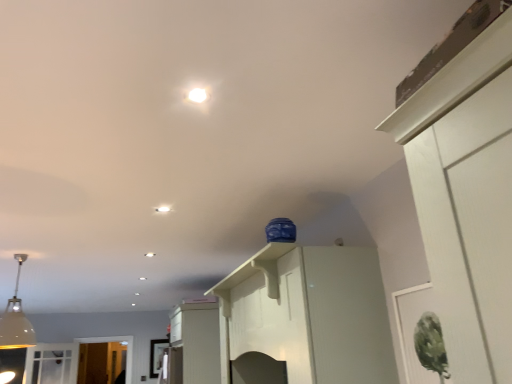
Measure the distance between white matte pendant light at left and camera.

A distance of 9.33 feet exists between white matte pendant light at left and camera.

Where is `white glossy cabinet at center, which is the 2th cabinetry in front-to-back order`? Image resolution: width=512 pixels, height=384 pixels. white glossy cabinet at center, which is the 2th cabinetry in front-to-back order is located at coordinates (198, 341).

Where is `white glossy light fixture at upper center`? white glossy light fixture at upper center is located at coordinates (197, 95).

At what (x,y) coordinates should I click in order to perform the action: click on white glossy light fixture at center. Please return your answer as a coordinate pair (x, y). Looking at the image, I should click on (163, 209).

Locate an element on the screen. Image resolution: width=512 pixels, height=384 pixels. white matte pendant light at left is located at coordinates (16, 319).

From the image's perspective, would you say white glossy light fixture at center is positioned over white matte pendant light at left?

Indeed, from the image's perspective, white glossy light fixture at center is shown above white matte pendant light at left.

How many degrees apart are the facing directions of white glossy light fixture at center and white matte pendant light at left?

87.2 degrees.

Is white glossy light fixture at center next to white matte pendant light at left and touching it?

There is a gap between white glossy light fixture at center and white matte pendant light at left.

Locate an element on the screen. Image resolution: width=512 pixels, height=384 pixels. light on the right of white matte pendant light at left is located at coordinates (163, 209).

From their relative heights in the image, would you say white matte pendant light at left is taller or shorter than white glossy light fixture at upper center?

white matte pendant light at left is taller than white glossy light fixture at upper center.

Does white matte pendant light at left have a greater width compared to white glossy light fixture at upper center?

Yes, white matte pendant light at left is wider than white glossy light fixture at upper center.

Which is more to the right, white matte pendant light at left or white glossy light fixture at upper center?

Positioned to the right is white glossy light fixture at upper center.

From a real-world perspective, relative to white glossy light fixture at upper center, is white matte pendant light at left vertically above or below?

white matte pendant light at left is situated lower than white glossy light fixture at upper center in the real world.

Looking at their sizes, would you say white glossy cabinet at upper center, which ranks as the 2th cabinetry in bottom-to-top order, is wider or thinner than white glossy light fixture at center?

Considering their sizes, white glossy cabinet at upper center, which ranks as the 2th cabinetry in bottom-to-top order, looks broader than white glossy light fixture at center.

From a real-world perspective, count 1st cabinetrys downward from the white glossy light fixture at center and point to it. Please provide its 2D coordinates.

[(310, 313)]

From the image's perspective, is white glossy cabinet at upper center, which ranks as the second cabinetry in back-to-front order, above or below white glossy light fixture at center?

From the image's perspective, white glossy cabinet at upper center, which ranks as the second cabinetry in back-to-front order, appears below white glossy light fixture at center.

Is white glossy cabinet at upper center, which is counted as the 1th cabinetry, starting from the top, to the left of white glossy light fixture at center from the viewer's perspective?

No.

Who is bigger, white glossy light fixture at center or white glossy cabinet at center, which is the 1th cabinetry in back-to-front order?

white glossy cabinet at center, which is the 1th cabinetry in back-to-front order.

Consider the image. Is there a large distance between white glossy light fixture at center and white glossy cabinet at center, which is counted as the first cabinetry, starting from the left?

white glossy light fixture at center is positioned a significant distance from white glossy cabinet at center, which is counted as the first cabinetry, starting from the left.

The width and height of the screenshot is (512, 384). Find the location of `cabinetry located behind the white glossy light fixture at center`. cabinetry located behind the white glossy light fixture at center is located at coordinates (198, 341).

Which of these two, white glossy light fixture at center or white glossy cabinet at center, the 1th cabinetry ordered from the bottom, is wider?

white glossy cabinet at center, the 1th cabinetry ordered from the bottom, is wider.

From a real-world perspective, is white glossy cabinet at center, which is the 1th cabinetry in back-to-front order, positioned above or below white matte pendant light at left?

white glossy cabinet at center, which is the 1th cabinetry in back-to-front order, is situated lower than white matte pendant light at left in the real world.

In terms of size, does white glossy cabinet at center, which is the 1th cabinetry in back-to-front order, appear bigger or smaller than white matte pendant light at left?

Clearly, white glossy cabinet at center, which is the 1th cabinetry in back-to-front order, is larger in size than white matte pendant light at left.

What's the angular difference between white glossy cabinet at center, the 1th cabinetry ordered from the bottom, and white matte pendant light at left's facing directions?

There is a 87.4-degree angle between the facing directions of white glossy cabinet at center, the 1th cabinetry ordered from the bottom, and white matte pendant light at left.

Who is more distant, white glossy cabinet at center, the 2th cabinetry from the right, or white matte pendant light at left?

white glossy cabinet at center, the 2th cabinetry from the right, is more distant.

Based on the photo, is white glossy cabinet at upper center, which ranks as the 2th cabinetry in bottom-to-top order, bigger than white glossy cabinet at center, the 2th cabinetry in the top-to-bottom sequence?

Incorrect, white glossy cabinet at upper center, which ranks as the 2th cabinetry in bottom-to-top order, is not larger than white glossy cabinet at center, the 2th cabinetry in the top-to-bottom sequence.

In the image, is white glossy cabinet at upper center, which ranks as the second cabinetry in back-to-front order, positioned in front of or behind white glossy cabinet at center, the 2th cabinetry from the right?

In the image, white glossy cabinet at upper center, which ranks as the second cabinetry in back-to-front order, appears in front of white glossy cabinet at center, the 2th cabinetry from the right.

Which is in front, point (247, 311) or point (217, 380)?

The point (247, 311) is in front.

Is white glossy cabinet at upper center, the first cabinetry viewed from the right, positioned with its back to white glossy cabinet at center, which is the 1th cabinetry in back-to-front order?

No, white glossy cabinet at upper center, the first cabinetry viewed from the right, is not facing away from white glossy cabinet at center, which is the 1th cabinetry in back-to-front order.

Does white matte pendant light at left contain white glossy cabinet at center, the 1th cabinetry ordered from the bottom?

No, white glossy cabinet at center, the 1th cabinetry ordered from the bottom, is not inside white matte pendant light at left.

From a real-world perspective, is white matte pendant light at left on top of white glossy cabinet at center, the 2th cabinetry in the top-to-bottom sequence?

Yes.

Is white matte pendant light at left taller than white glossy cabinet at center, the 2th cabinetry from the right?

No.

In the image, there is a white matte pendant light at left. Identify the location of light above it (from the image's perspective). Image resolution: width=512 pixels, height=384 pixels. (163, 209).

Find the location of a particular element. This screenshot has height=384, width=512. lighting that appears in front of the white matte pendant light at left is located at coordinates (197, 95).

Looking at the image, which one is located further to white glossy light fixture at center, white matte pendant light at left or white glossy cabinet at upper center, which is counted as the 1th cabinetry, starting from the top?

Among the two, white matte pendant light at left is located further to white glossy light fixture at center.

Which object lies further to the anchor point white glossy light fixture at center, white glossy light fixture at upper center or white matte pendant light at left?

Among the two, white matte pendant light at left is located further to white glossy light fixture at center.

Based on their spatial positions, is white glossy light fixture at upper center or white glossy light fixture at center further from white matte pendant light at left?

white glossy light fixture at upper center lies further to white matte pendant light at left than the other object.

Looking at the image, which one is located closer to white glossy cabinet at upper center, the first cabinetry viewed from the right, white glossy cabinet at center, which is counted as the first cabinetry, starting from the left, or white matte pendant light at left?

white glossy cabinet at center, which is counted as the first cabinetry, starting from the left.

Looking at the image, which one is located closer to white glossy light fixture at upper center, white glossy light fixture at center or white glossy cabinet at center, which is counted as the first cabinetry, starting from the left?

The object closer to white glossy light fixture at upper center is white glossy light fixture at center.

Looking at the image, which one is located further to white glossy cabinet at center, which is counted as the first cabinetry, starting from the left, white glossy light fixture at upper center or white matte pendant light at left?

white glossy light fixture at upper center is further to white glossy cabinet at center, which is counted as the first cabinetry, starting from the left.

When comparing their distances from white glossy cabinet at center, which is the 2th cabinetry in front-to-back order, does white glossy light fixture at upper center or white glossy light fixture at center seem closer?

Among the two, white glossy light fixture at center is located nearer to white glossy cabinet at center, which is the 2th cabinetry in front-to-back order.

In the scene shown: When comparing their distances from white glossy light fixture at center, does white glossy light fixture at upper center or white glossy cabinet at center, which is the 1th cabinetry in back-to-front order, seem closer?

white glossy light fixture at upper center is positioned closer to the anchor white glossy light fixture at center.

Identify the location of cabinetry between white glossy light fixture at upper center and white glossy cabinet at center, which is the 1th cabinetry in back-to-front order, in the front-back direction. Image resolution: width=512 pixels, height=384 pixels. pyautogui.click(x=310, y=313).

You are a GUI agent. You are given a task and a screenshot of the screen. Output one action in this format:
    pyautogui.click(x=<x>, y=<y>)
    Task: Click on the light between white matte pendant light at left and white glossy cabinet at upper center, which ranks as the 2th cabinetry in bottom-to-top order, from left to right
    Image resolution: width=512 pixels, height=384 pixels.
    Given the screenshot: What is the action you would take?
    pyautogui.click(x=163, y=209)

This screenshot has width=512, height=384. I want to click on lighting located between white matte pendant light at left and white glossy cabinet at upper center, which is counted as the 1th cabinetry, starting from the top, in the left-right direction, so click(x=197, y=95).

At what (x,y) coordinates should I click in order to perform the action: click on light located between white glossy light fixture at upper center and white glossy cabinet at center, the 1th cabinetry ordered from the bottom, in the depth direction. Please return your answer as a coordinate pair (x, y). The width and height of the screenshot is (512, 384). Looking at the image, I should click on (163, 209).